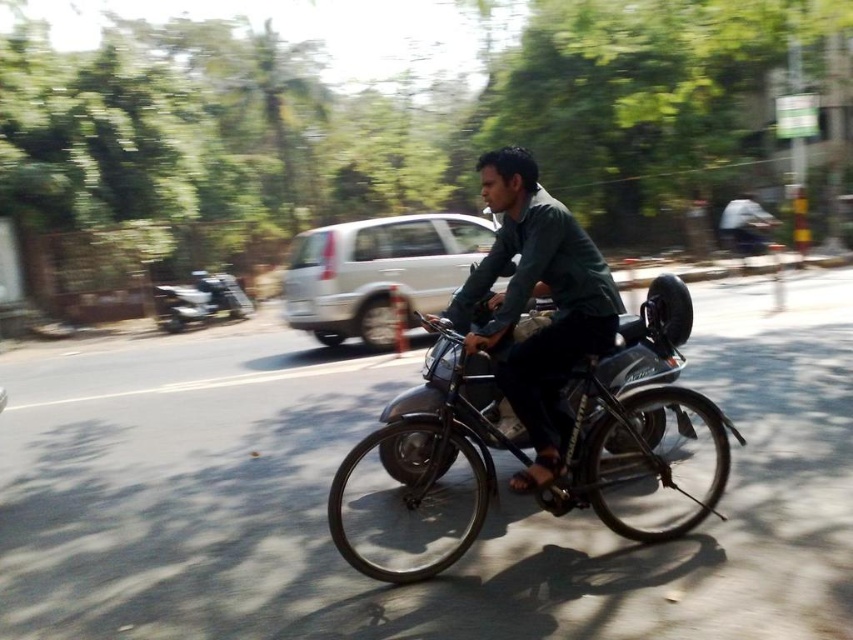
From the picture: You are a pedestrian standing on the sidewalk and see the green matte shirt at center and the metallic silver scooter at left in the street. Which object is nearer to you?

The green matte shirt at center is closer to the viewer than the metallic silver scooter at left.

You are a photographer positioned at a certain spot. You want to capture a clear photo of the metallic silver motorcycle at center. The camera you are using has a maximum focus range of 3 meters. Will the camera be able to focus on the motorcycle?

The metallic silver motorcycle at center is 3.11 meters away from the camera. Since the maximum focus range is 3 meters, the camera cannot focus on the motorcycle because it is slightly beyond the range.

From the picture: You are a photographer trying to capture a closeup of the metallic silver motorcycle at center and the green matte shirt at center in the image. Given that your camera can only focus on objects within 18 inches of each other, will both subjects be in focus?

The metallic silver motorcycle at center is 18.67 inches from the green matte shirt at center, which exceeds the camera focus range of 18 inches. Therefore, both subjects cannot be in focus simultaneously.